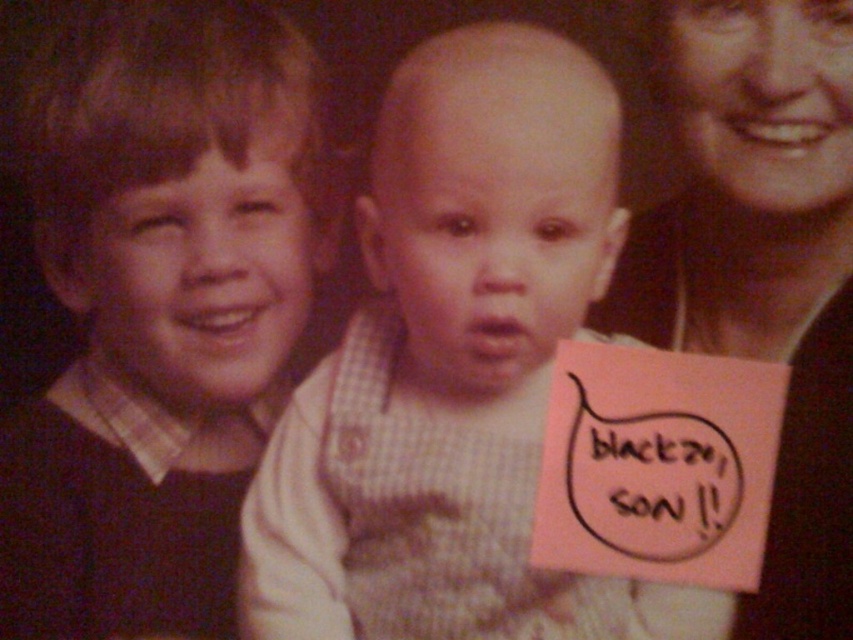
Can you confirm if matte black sweater at left is positioned to the right of smooth skin face at upper right?

In fact, matte black sweater at left is to the left of smooth skin face at upper right.

In the scene shown: Does matte black sweater at left have a greater height compared to smooth skin face at upper right?

Yes, matte black sweater at left is taller than smooth skin face at upper right.

Is point (102, 593) positioned behind point (795, 1)?

Yes, point (102, 593) is farther from viewer.

The height and width of the screenshot is (640, 853). I want to click on matte black sweater at left, so click(158, 308).

Is checkered fabric shirt at center closer to camera compared to matte black sweater at left?

Yes.

Between checkered fabric shirt at center and matte black sweater at left, which one has less height?

checkered fabric shirt at center

Is point (387, 609) more distant than point (192, 17)?

No, (387, 609) is closer to viewer.

The image size is (853, 640). What are the coordinates of `checkered fabric shirt at center` in the screenshot? It's located at (456, 369).

Which is more to the right, checkered fabric shirt at center or smooth skin face at upper right?

smooth skin face at upper right

Which is behind, point (540, 212) or point (689, 317)?

The point (689, 317) is more distant.

The height and width of the screenshot is (640, 853). In order to click on checkered fabric shirt at center in this screenshot , I will do `click(456, 369)`.